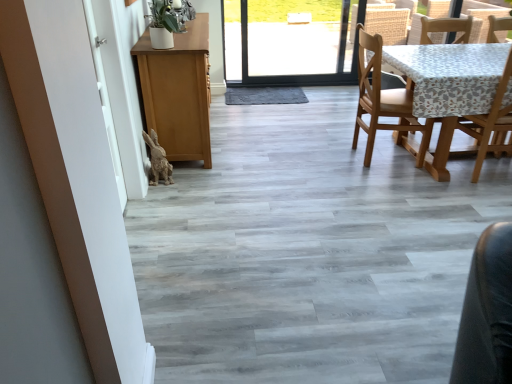
Question: Can you confirm if wooden chair at right is smaller than wooden chair at right, which is counted as the first chair, starting from the right?

Choices:
 (A) no
 (B) yes

Answer: (B)

Question: From the image's perspective, is wooden chair at right on wooden chair at right, which is counted as the first chair, starting from the right?

Choices:
 (A) yes
 (B) no

Answer: (A)

Question: Is wooden chair at right not near wooden chair at right, which is counted as the first chair, starting from the right?

Choices:
 (A) no
 (B) yes

Answer: (A)

Question: Does wooden chair at right have a greater width compared to wooden chair at right, which is counted as the first chair, starting from the right?

Choices:
 (A) no
 (B) yes

Answer: (A)

Question: Does wooden chair at right appear on the right side of wooden chair at right, acting as the second chair starting from the left?

Choices:
 (A) yes
 (B) no

Answer: (A)

Question: Is wooden chair at right, acting as the second chair starting from the left, inside or outside of white matte screen door at left?

Choices:
 (A) inside
 (B) outside

Answer: (B)

Question: Is wooden chair at right, which is counted as the first chair, starting from the right, bigger or smaller than white matte screen door at left?

Choices:
 (A) big
 (B) small

Answer: (A)

Question: Based on their positions, is wooden chair at right, which is counted as the first chair, starting from the right, located to the left or right of white matte screen door at left?

Choices:
 (A) right
 (B) left

Answer: (A)

Question: From the image's perspective, is wooden chair at right, which is counted as the first chair, starting from the right, positioned above or below white matte screen door at left?

Choices:
 (A) below
 (B) above

Answer: (B)

Question: Is wooden chair at right, acting as the second chair starting from the left, bigger or smaller than wooden chair at right?

Choices:
 (A) small
 (B) big

Answer: (B)

Question: From a real-world perspective, relative to wooden chair at right, is wooden chair at right, acting as the second chair starting from the left, vertically above or below?

Choices:
 (A) above
 (B) below

Answer: (B)

Question: Considering the positions of point (499, 114) and point (485, 18), is point (499, 114) closer or farther from the camera than point (485, 18)?

Choices:
 (A) farther
 (B) closer

Answer: (B)

Question: Relative to wooden chair at right, is wooden chair at right, which is counted as the first chair, starting from the right, in front or behind?

Choices:
 (A) front
 (B) behind

Answer: (A)

Question: Considering the positions of wooden chair at right, marked as the 1th chair in a left-to-right arrangement, and wooden chair at right in the image, is wooden chair at right, marked as the 1th chair in a left-to-right arrangement, taller or shorter than wooden chair at right?

Choices:
 (A) tall
 (B) short

Answer: (A)

Question: Is wooden chair at right, marked as the 2th chair in a right-to-left arrangement, wider or thinner than wooden chair at right?

Choices:
 (A) wide
 (B) thin

Answer: (A)